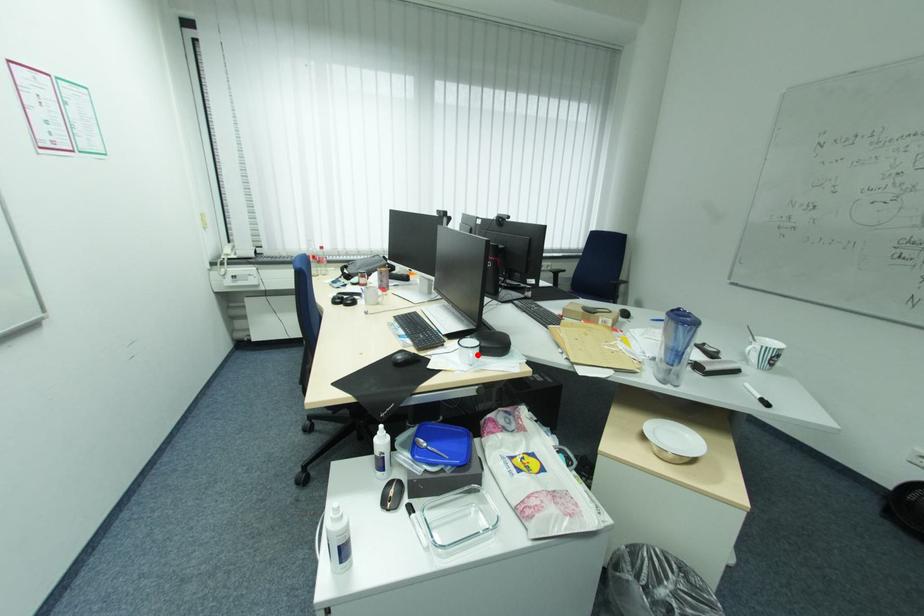
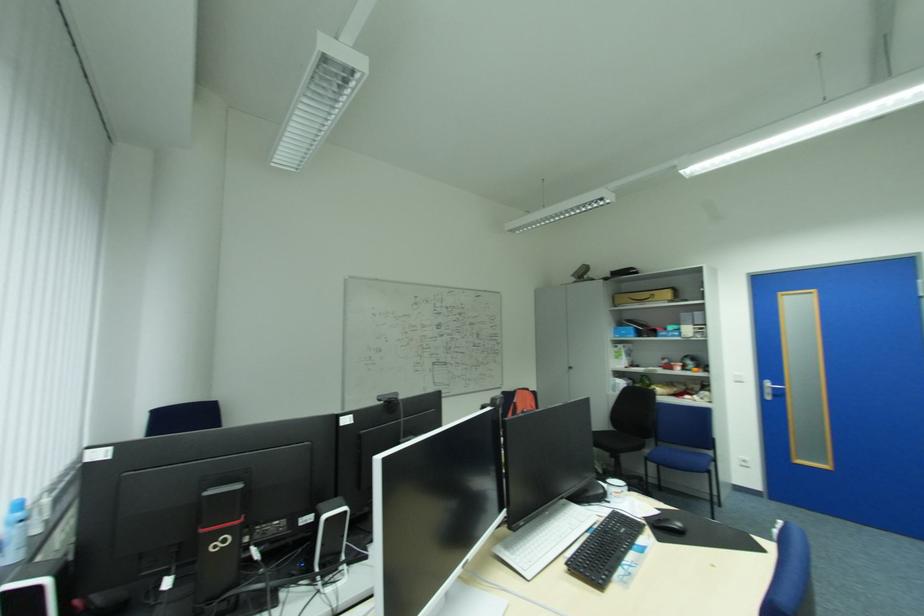
Question: I am providing you with two images of the same scene from different viewpoints. In image1, a red point is highlighted. Considering the same 3D point in image2, which of the following is correct?

Choices:
 (A) It is closer
 (B) It is farther

Answer: (A)